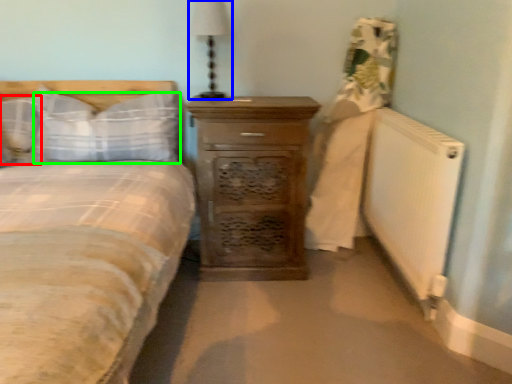
Question: Considering the real-world distances, which object is closest to pillow (highlighted by a red box)? bedside lamp (highlighted by a blue box) or pillow (highlighted by a green box).

Choices:
 (A) bedside lamp
 (B) pillow

Answer: (B)